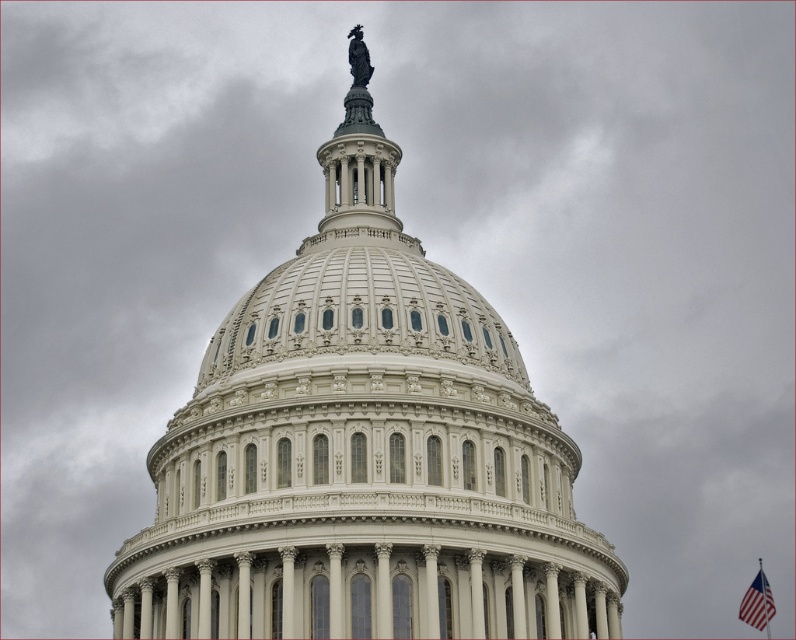
Consider the image. You are a photographer planning to capture the United States Capitol dome and the American flag in the same frame. Given that the white marble dome at center is wider than the american flag at lower right, how does the size of the dome compare to the flag in the image?

The white marble dome at center is wider than the american flag at lower right, making it appear larger in the image.

You are a photographer planning to capture the United States Capitol dome and the American flag in the same frame. Given that the white marble dome at center is taller than the american flag at lower right, how would you position your camera to ensure both are fully visible in the photo?

To include both the white marble dome at center and the american flag at lower right in the frame, position the camera at a distance where the dome, being taller, doesn not block the flag. Ensure the flag is placed lower in the composition so its shorter height remains visible below the dome.